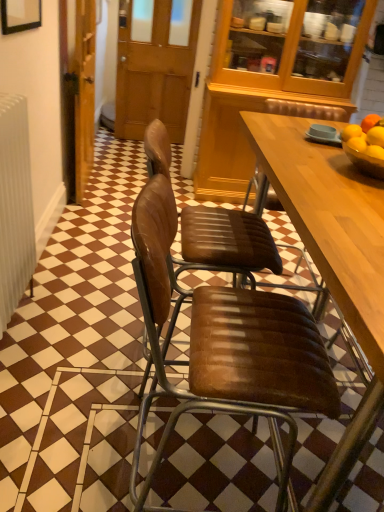
Question: Choose the correct answer: Is brown leather chair at center, arranged as the 2th chair when ordered from the bottom, inside wooden door at left or outside it?

Choices:
 (A) inside
 (B) outside

Answer: (B)

Question: From their relative heights in the image, would you say brown leather chair at center, arranged as the 2th chair when ordered from the bottom, is taller or shorter than wooden door at left?

Choices:
 (A) short
 (B) tall

Answer: (A)

Question: Based on their relative distances, which object is farther from the brown wooden door at center?

Choices:
 (A) brown leather chair at center, the 1th chair positioned from the bottom
 (B) yellow matte/orange matte/orange bowl at right
 (C) brown leather chair at center, the first chair when ordered from top to bottom
 (D) wooden door at left

Answer: (A)

Question: Which object is the closest to the wooden door at left?

Choices:
 (A) yellow matte/orange matte/orange bowl at right
 (B) brown leather chair at center, the first chair when ordered from top to bottom
 (C) brown wooden door at center
 (D) brown leather chair at center, the 1th chair positioned from the bottom

Answer: (C)